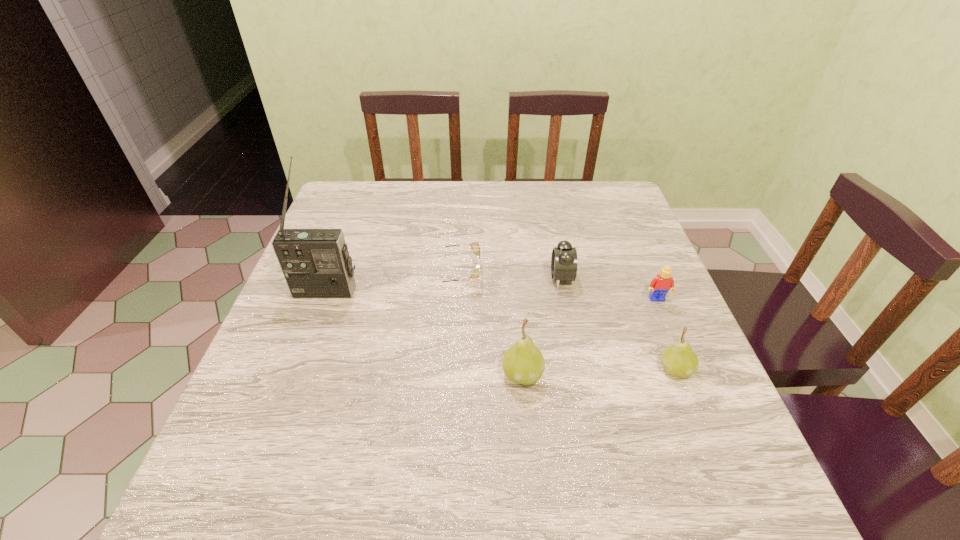
Considering the uniform spacing of pears, where should an additional pear be positioned on the left? Please locate a free spot. Please provide its 2D coordinates. Your answer should be formatted as a tuple, i.e. [(x, y)], where the tuple contains the x and y coordinates of a point satisfying the conditions above.

[(367, 378)]